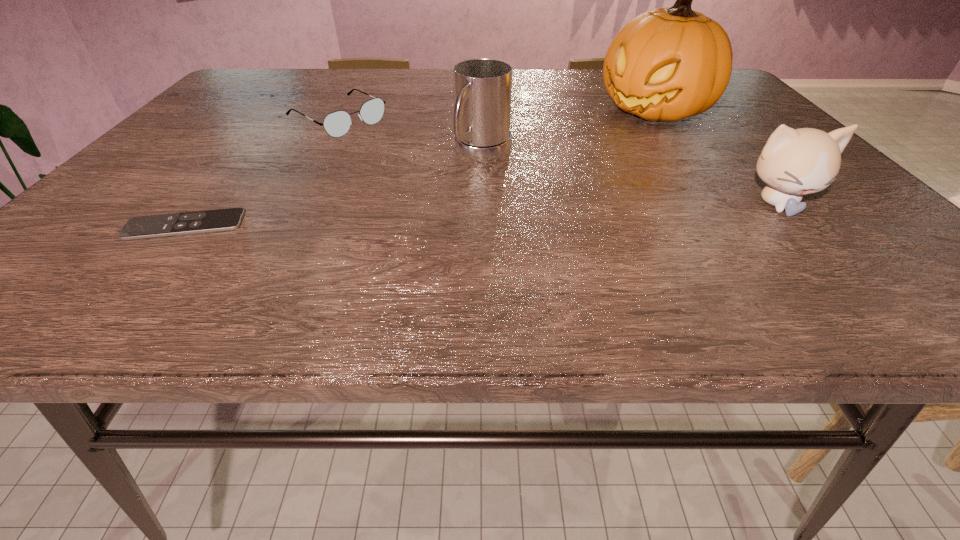
Identify the location of free space on the desktop that is between the remote control and the kitten and is positioned on the front face of the tallest object. (467, 215).

Find the location of a particular element. This screenshot has height=540, width=960. free spot on the desktop that is between the shortest object and the kitten and is positioned on the side of the third object from left to right with the handle is located at coordinates (417, 217).

Identify the location of free space on the desktop that is between the remote control and the kitten and is positioned on the lenses of the fourth tallest object. The width and height of the screenshot is (960, 540). (517, 213).